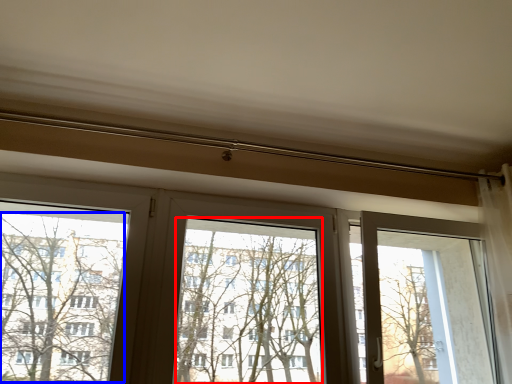
Question: Which of the following is the closest to the observer, window screen (highlighted by a red box) or tree (highlighted by a blue box)?

Choices:
 (A) window screen
 (B) tree

Answer: (B)